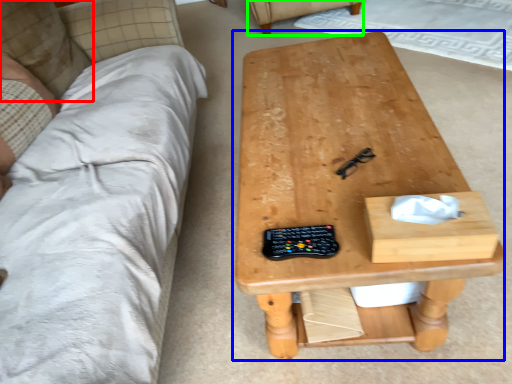
Question: Estimate the real-world distances between objects in this image. Which object is farther from pillow (highlighted by a red box), table (highlighted by a blue box) or armchair (highlighted by a green box)?

Choices:
 (A) table
 (B) armchair

Answer: (B)